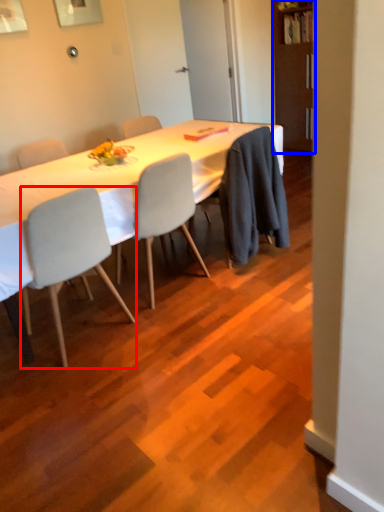
Question: Which object appears closest to the camera in this image, chair (highlighted by a red box) or bookshelf (highlighted by a blue box)?

Choices:
 (A) chair
 (B) bookshelf

Answer: (A)